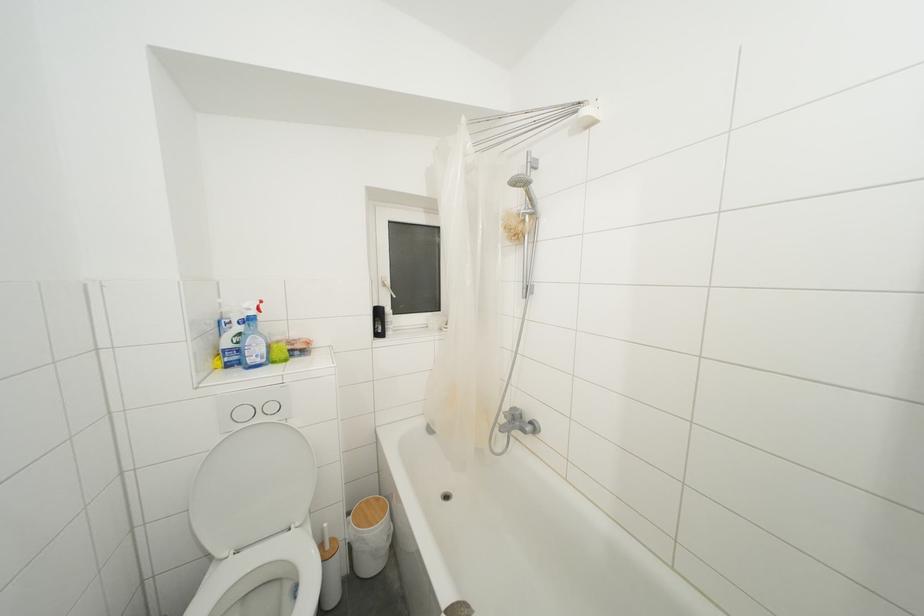
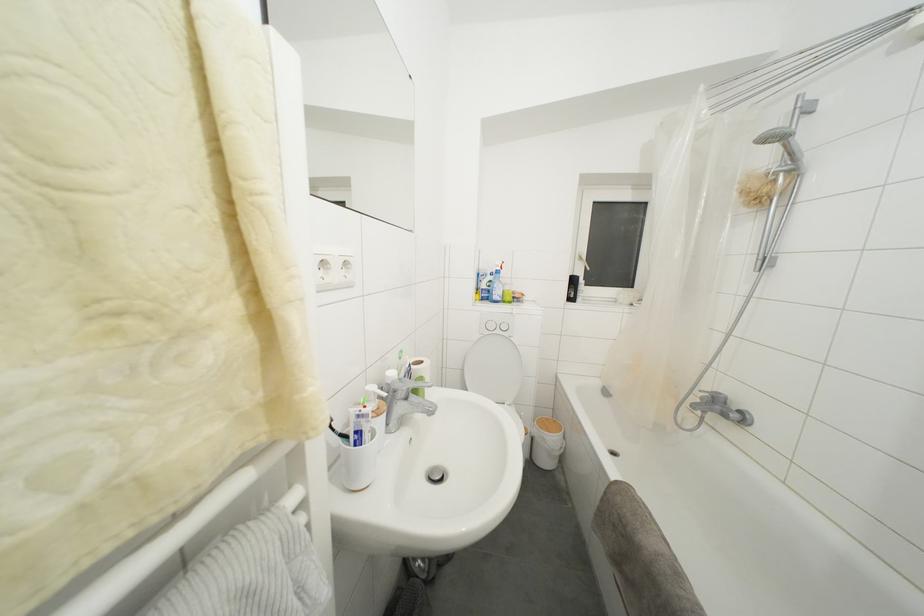
Locate, in the second image, the point that corresponds to (x=237, y=363) in the first image.

(490, 301)